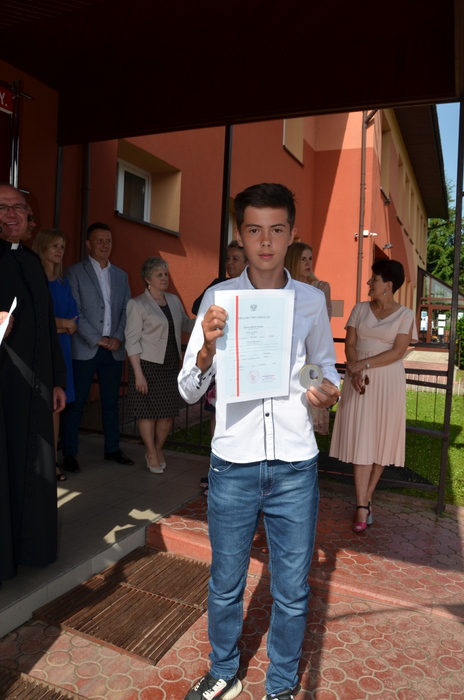
Locate an element on the screen. The height and width of the screenshot is (700, 464). decorative brick is located at coordinates (367, 651).